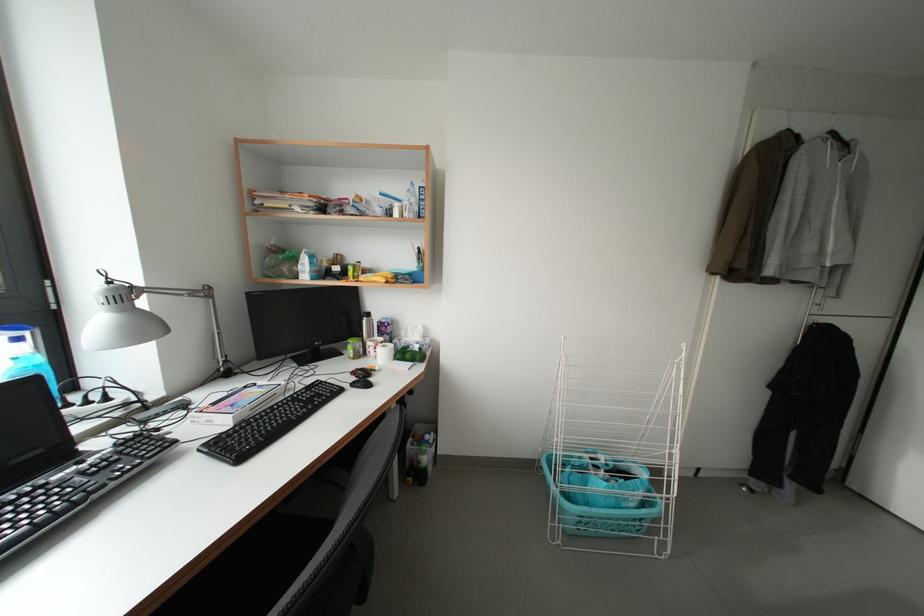
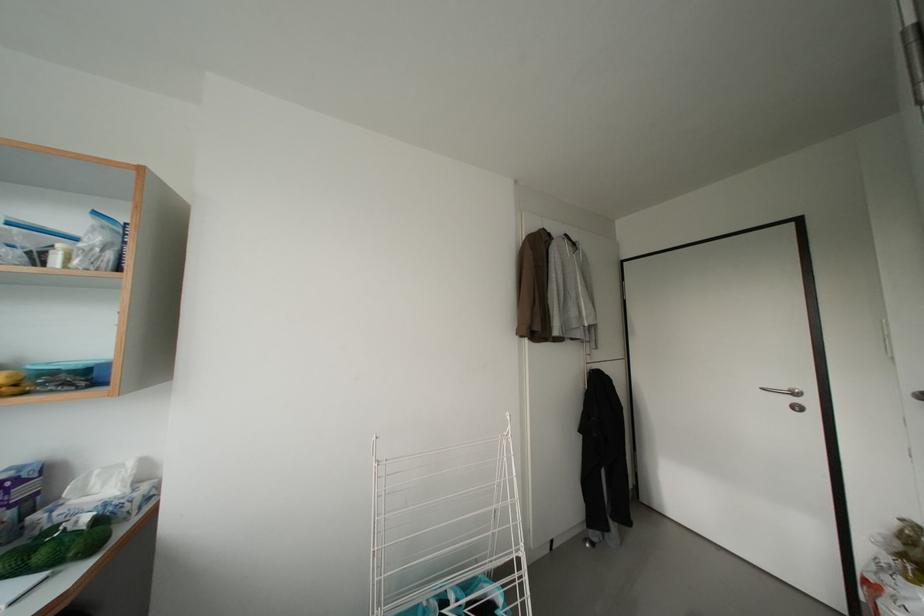
Question: The images are taken continuously from a first-person perspective. In which direction is your viewpoint rotating?

Choices:
 (A) Left
 (B) Right
 (C) Up
 (D) Down

Answer: (B)